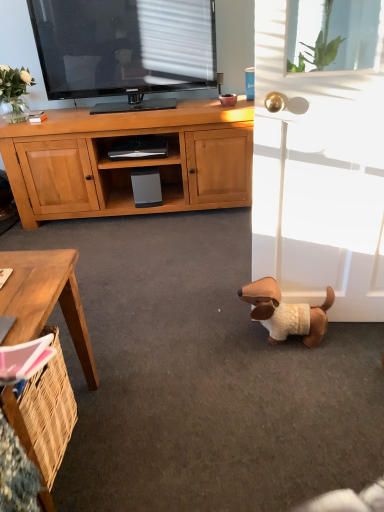
The width and height of the screenshot is (384, 512). I want to click on white glass vase at upper left, so click(x=15, y=91).

The width and height of the screenshot is (384, 512). I want to click on white matte screen door at lower right, so coord(321,153).

Find the location of a particular element. brown plush dog at lower right is located at coordinates (286, 313).

Locate an element on the screen. This screenshot has height=512, width=384. transparent glass window screen at upper right is located at coordinates (332, 35).

Would you say transparent glass window screen at upper right is part of brown plush dog at lower right's contents?

No, transparent glass window screen at upper right is not surrounded by brown plush dog at lower right.

Does brown plush dog at lower right appear on the right side of transparent glass window screen at upper right?

No, brown plush dog at lower right is not to the right of transparent glass window screen at upper right.

Does brown plush dog at lower right have a greater height compared to transparent glass window screen at upper right?

Incorrect, the height of brown plush dog at lower right is not larger of that of transparent glass window screen at upper right.

What's the angular difference between brown plush dog at lower right and transparent glass window screen at upper right's facing directions?

The angle between the facing direction of brown plush dog at lower right and the facing direction of transparent glass window screen at upper right is 96.3 degrees.

Can you confirm if white glass vase at upper left is wider than brown wooden desk at lower left?

No.

From a real-world perspective, is white glass vase at upper left on top of brown wooden desk at lower left?

Yes, from a real-world perspective, white glass vase at upper left is above brown wooden desk at lower left.

Is white glass vase at upper left placed right next to brown wooden desk at lower left?

No, white glass vase at upper left is not with brown wooden desk at lower left.

In terms of size, does white glass vase at upper left appear bigger or smaller than brown wooden desk at lower left?

Considering their sizes, white glass vase at upper left takes up less space than brown wooden desk at lower left.

In terms of height, does brown plush dog at lower right look taller or shorter compared to white glass vase at upper left?

Clearly, brown plush dog at lower right is shorter compared to white glass vase at upper left.

Is brown plush dog at lower right aimed at white glass vase at upper left?

No, brown plush dog at lower right is not turned towards white glass vase at upper left.

From a real-world perspective, is brown plush dog at lower right below white glass vase at upper left?

Yes.

Does white glass vase at upper left have a greater width compared to brown plush dog at lower right?

No, white glass vase at upper left is not wider than brown plush dog at lower right.

From the picture: Which is farther, (x=0, y=92) or (x=329, y=308)?

Point (x=0, y=92)

Is white glass vase at upper left far from brown plush dog at lower right?

Absolutely, white glass vase at upper left is distant from brown plush dog at lower right.

Is white glass vase at upper left shorter than white matte screen door at lower right?

Indeed, white glass vase at upper left has a lesser height compared to white matte screen door at lower right.

Is white glass vase at upper left completely or partially outside of white matte screen door at lower right?

Absolutely, white glass vase at upper left is external to white matte screen door at lower right.

Which of these two, white glass vase at upper left or white matte screen door at lower right, is wider?

With larger width is white matte screen door at lower right.

Which point is more forward, (9, 101) or (334, 314)?

Positioned in front is point (334, 314).

Looking at this image, how many degrees apart are the facing directions of white glass vase at upper left and transparent glass window screen at upper right?

The angle between the facing direction of white glass vase at upper left and the facing direction of transparent glass window screen at upper right is 1.71 degrees.

Find the location of a particular element. window screen located on the right of white glass vase at upper left is located at coordinates [332, 35].

Does point (21, 86) come behind point (316, 51)?

Yes, point (21, 86) is behind point (316, 51).

From a real-world perspective, is white glass vase at upper left above or below transparent glass window screen at upper right?

In terms of real-world spatial position, white glass vase at upper left is below transparent glass window screen at upper right.

Is point (53, 254) positioned behind point (33, 84)?

No, it is not.

Based on the photo, considering the relative sizes of brown wooden desk at lower left and white glass vase at upper left in the image provided, is brown wooden desk at lower left smaller than white glass vase at upper left?

Incorrect, brown wooden desk at lower left is not smaller in size than white glass vase at upper left.

Based on the photo, considering the relative positions of brown wooden desk at lower left and white glass vase at upper left in the image provided, is brown wooden desk at lower left to the right of white glass vase at upper left from the viewer's perspective?

Yes, brown wooden desk at lower left is to the right of white glass vase at upper left.

Would you consider brown wooden desk at lower left to be distant from white glass vase at upper left?

brown wooden desk at lower left is positioned a significant distance from white glass vase at upper left.

This screenshot has width=384, height=512. Find the location of `dog on the left of the transparent glass window screen at upper right`. dog on the left of the transparent glass window screen at upper right is located at coordinates (286, 313).

I want to click on desk located underneath the white glass vase at upper left (from a real-world perspective), so click(46, 300).

Considering their positions, is white glass vase at upper left positioned further to brown wooden desk at lower left than transparent glass window screen at upper right?

Among the two, transparent glass window screen at upper right is located further to brown wooden desk at lower left.

Considering their positions, is white glass vase at upper left positioned further to transparent glass window screen at upper right than brown wooden desk at lower left?

brown wooden desk at lower left lies further to transparent glass window screen at upper right than the other object.

Looking at the image, which one is located closer to brown plush dog at lower right, brown wooden desk at lower left or transparent glass window screen at upper right?

Based on the image, brown wooden desk at lower left appears to be nearer to brown plush dog at lower right.

Based on their spatial positions, is white matte screen door at lower right or brown wooden desk at lower left closer to brown plush dog at lower right?

white matte screen door at lower right is positioned closer to the anchor brown plush dog at lower right.

Looking at the image, which one is located closer to brown plush dog at lower right, white glass vase at upper left or brown wooden desk at lower left?

A: brown wooden desk at lower left.

Based on their spatial positions, is transparent glass window screen at upper right or brown wooden desk at lower left further from white matte screen door at lower right?

The object further to white matte screen door at lower right is transparent glass window screen at upper right.

Which object lies further to the anchor point brown plush dog at lower right, white glass vase at upper left or white matte screen door at lower right?

Among the two, white glass vase at upper left is located further to brown plush dog at lower right.

When comparing their distances from brown plush dog at lower right, does white glass vase at upper left or transparent glass window screen at upper right seem further?

white glass vase at upper left is positioned further to the anchor brown plush dog at lower right.

At what (x,y) coordinates should I click in order to perform the action: click on dog between transparent glass window screen at upper right and brown wooden desk at lower left in the vertical direction. Please return your answer as a coordinate pair (x, y). Looking at the image, I should click on (286, 313).

Locate an element on the screen. The image size is (384, 512). dog between white glass vase at upper left and white matte screen door at lower right from left to right is located at coordinates (286, 313).

Identify the location of screen door located between white glass vase at upper left and transparent glass window screen at upper right in the left-right direction. This screenshot has height=512, width=384. (321, 153).

Image resolution: width=384 pixels, height=512 pixels. I want to click on dog between white glass vase at upper left and transparent glass window screen at upper right from left to right, so click(x=286, y=313).